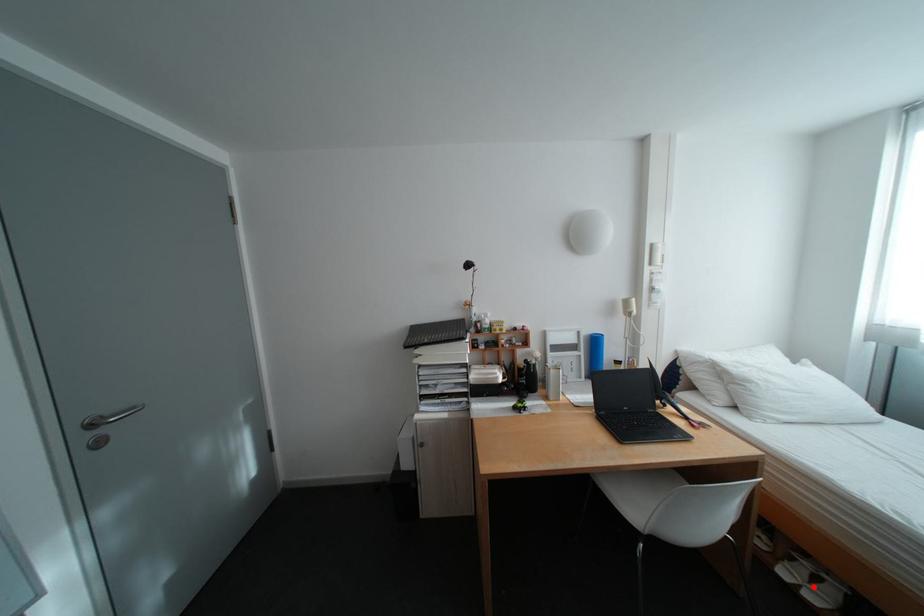
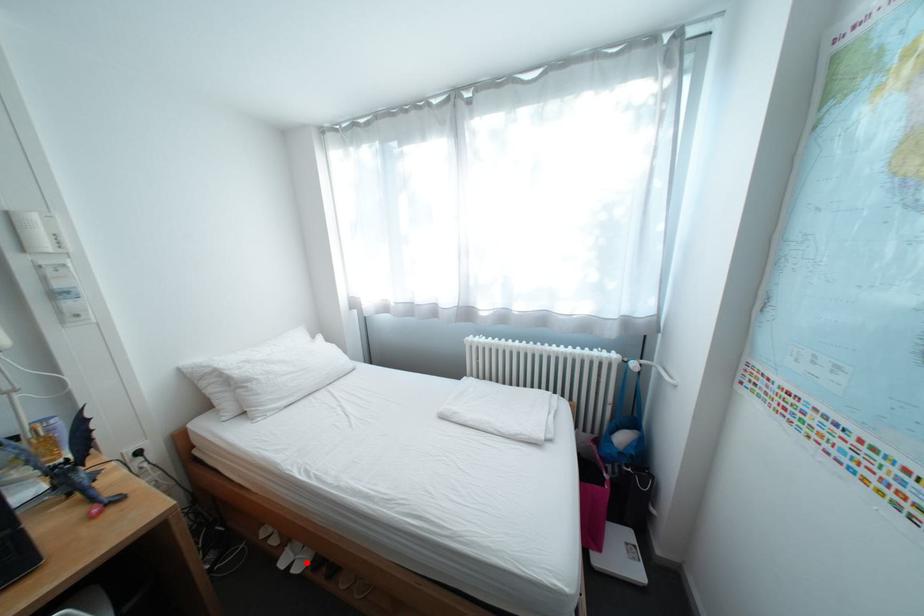
I am providing you with two images of the same scene from different viewpoints. A red point is marked on the first image and another point is marked on the second image. Is the red point in image1 aligned with the point shown in image2?

Yes